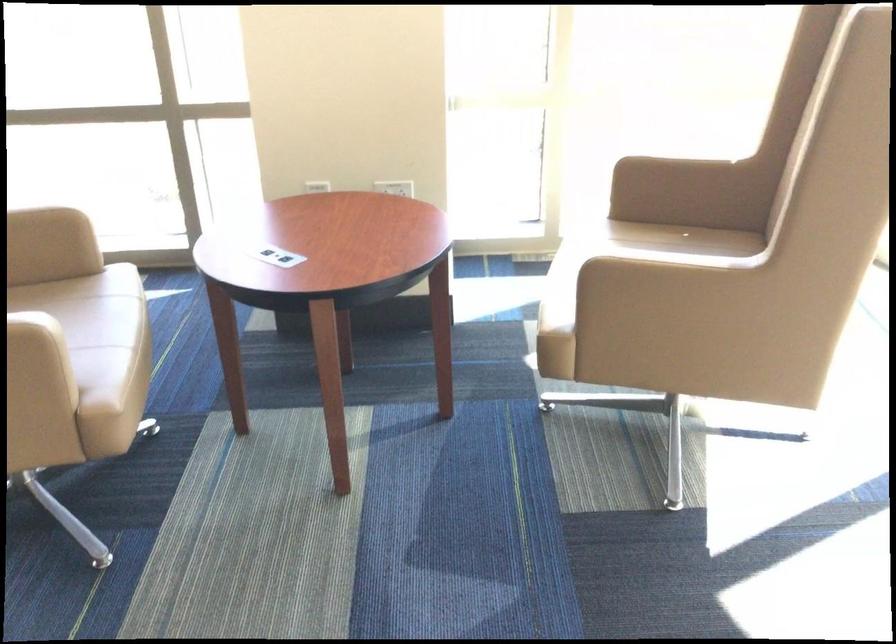
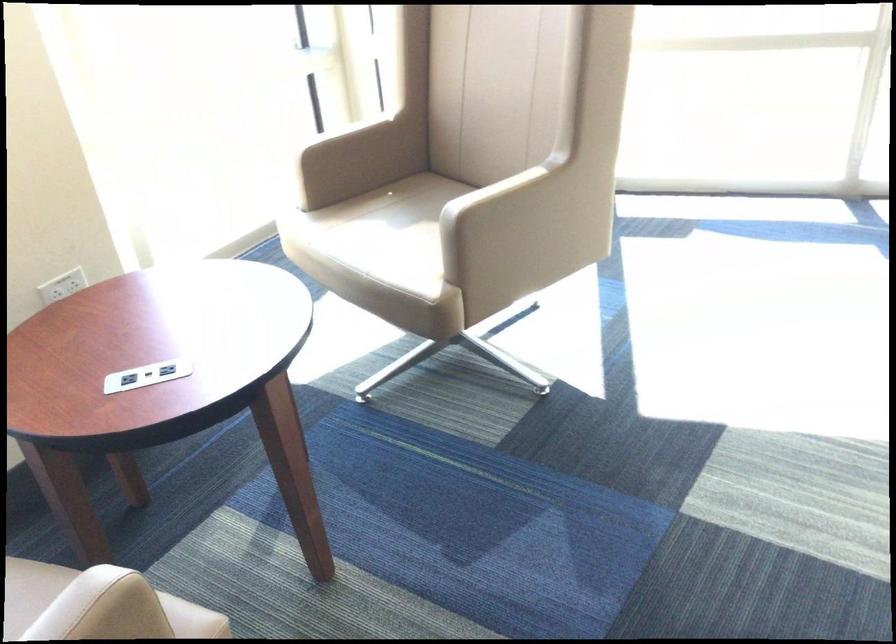
In the second image, find the point that corresponds to (x=282, y=254) in the first image.

(147, 375)